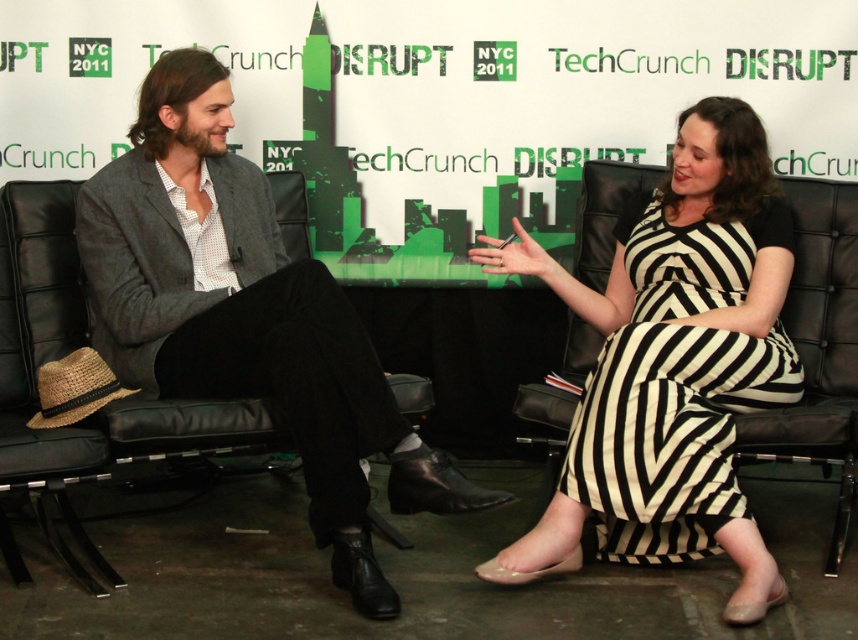
Question: Which point appears closest to the camera in this image?

Choices:
 (A) (298, 372)
 (B) (576, 448)

Answer: (A)

Question: Is the position of matte gray blazer at center more distant than that of black and white striped dress at center?

Choices:
 (A) yes
 (B) no

Answer: (B)

Question: Is matte gray blazer at center positioned in front of black and white striped dress at center?

Choices:
 (A) no
 (B) yes

Answer: (B)

Question: Does matte gray blazer at center appear over black and white striped dress at center?

Choices:
 (A) yes
 (B) no

Answer: (A)